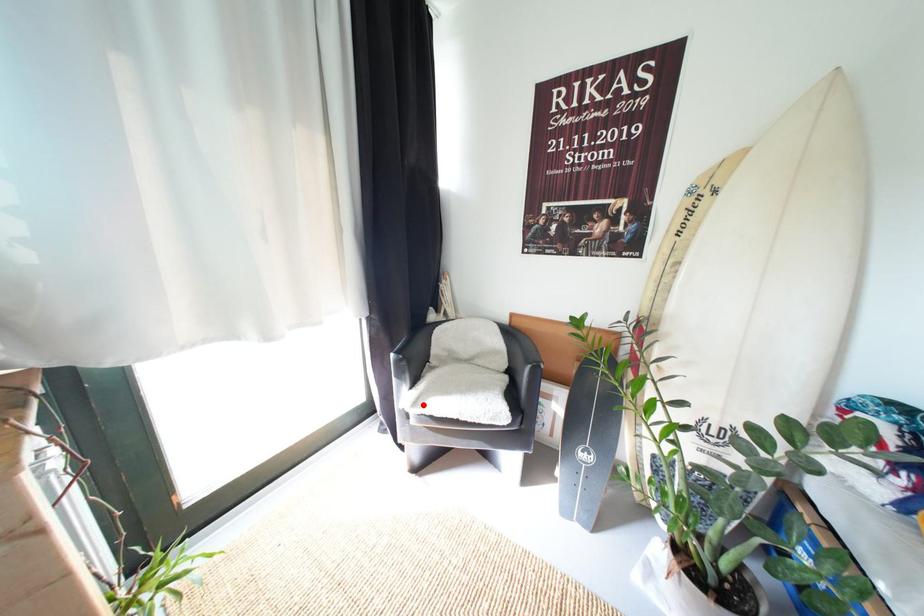
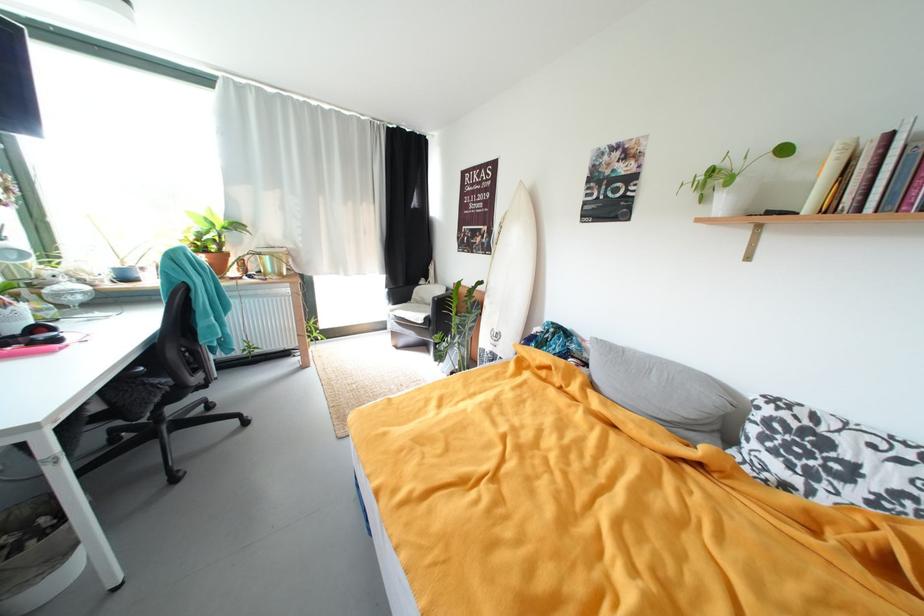
Locate, in the second image, the point that corresponds to the highlighted location in the first image.

(399, 313)